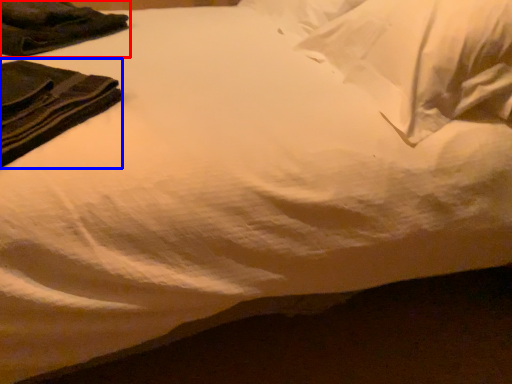
Question: Which of the following is the farthest to the observer, clothing (highlighted by a red box) or clothing (highlighted by a blue box)?

Choices:
 (A) clothing
 (B) clothing

Answer: (A)